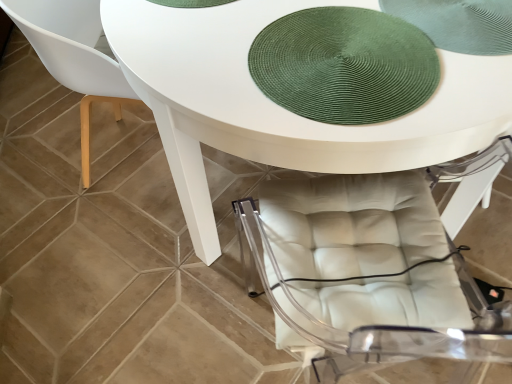
Question: Does green woven mat at upper center come in front of matte white chair at lower left?

Choices:
 (A) yes
 (B) no

Answer: (A)

Question: Can you confirm if green woven mat at upper center is bigger than matte white chair at lower left?

Choices:
 (A) yes
 (B) no

Answer: (B)

Question: Is green woven mat at upper center positioned beyond the bounds of matte white chair at lower left?

Choices:
 (A) no
 (B) yes

Answer: (B)

Question: Considering the relative sizes of green woven mat at upper center and matte white chair at lower left in the image provided, is green woven mat at upper center taller than matte white chair at lower left?

Choices:
 (A) no
 (B) yes

Answer: (A)

Question: Is green woven mat at upper center shorter than matte white chair at lower left?

Choices:
 (A) no
 (B) yes

Answer: (B)

Question: From the image's perspective, is matte white chair at lower left above or below white glossy table at center?

Choices:
 (A) below
 (B) above

Answer: (B)

Question: From their relative heights in the image, would you say matte white chair at lower left is taller or shorter than white glossy table at center?

Choices:
 (A) tall
 (B) short

Answer: (A)

Question: From a real-world perspective, is matte white chair at lower left physically located above or below white glossy table at center?

Choices:
 (A) above
 (B) below

Answer: (A)

Question: Looking at the image, does matte white chair at lower left seem bigger or smaller compared to white glossy table at center?

Choices:
 (A) small
 (B) big

Answer: (A)

Question: From a real-world perspective, is green woven mat at upper center above or below white glossy table at center?

Choices:
 (A) above
 (B) below

Answer: (A)

Question: Is point (408, 24) closer or farther from the camera than point (376, 137)?

Choices:
 (A) closer
 (B) farther

Answer: (B)

Question: Is green woven mat at upper center in front of or behind white glossy table at center in the image?

Choices:
 (A) front
 (B) behind

Answer: (B)

Question: In terms of height, does green woven mat at upper center look taller or shorter compared to white glossy table at center?

Choices:
 (A) tall
 (B) short

Answer: (B)

Question: In terms of height, does white glossy table at center look taller or shorter compared to green woven mat at upper center?

Choices:
 (A) tall
 (B) short

Answer: (A)

Question: Relative to green woven mat at upper center, is white glossy table at center in front or behind?

Choices:
 (A) front
 (B) behind

Answer: (A)